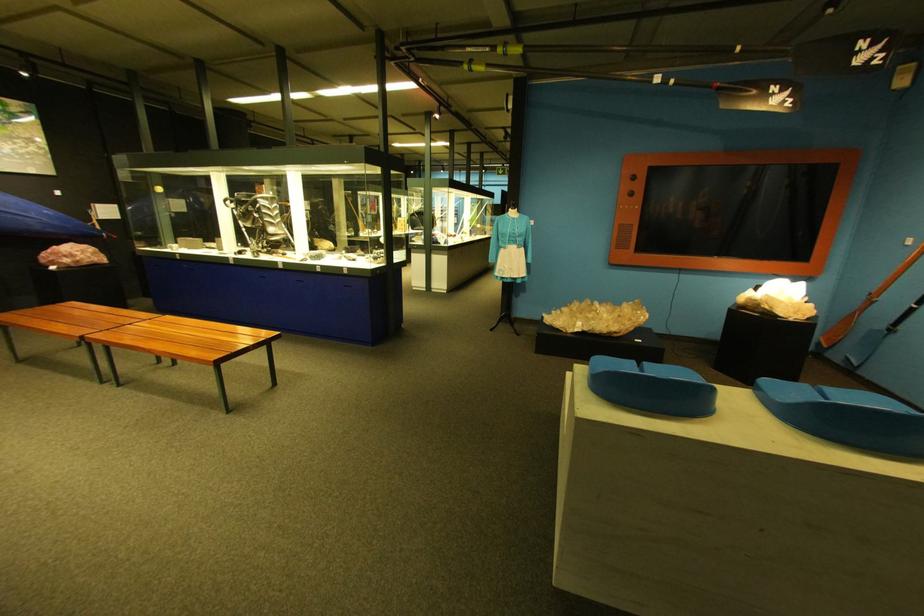
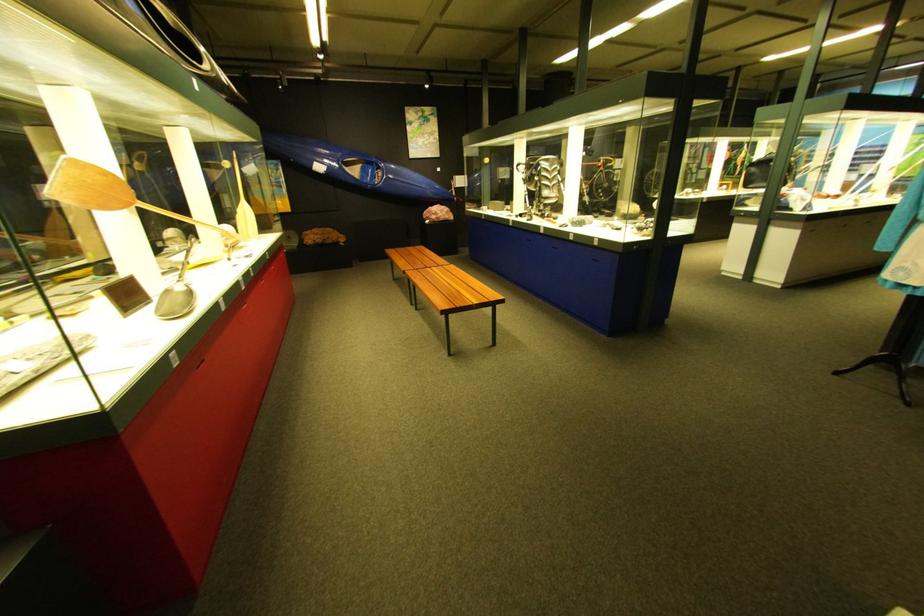
Locate, in the second image, the point that corresponds to (334,272) in the first image.

(588, 240)